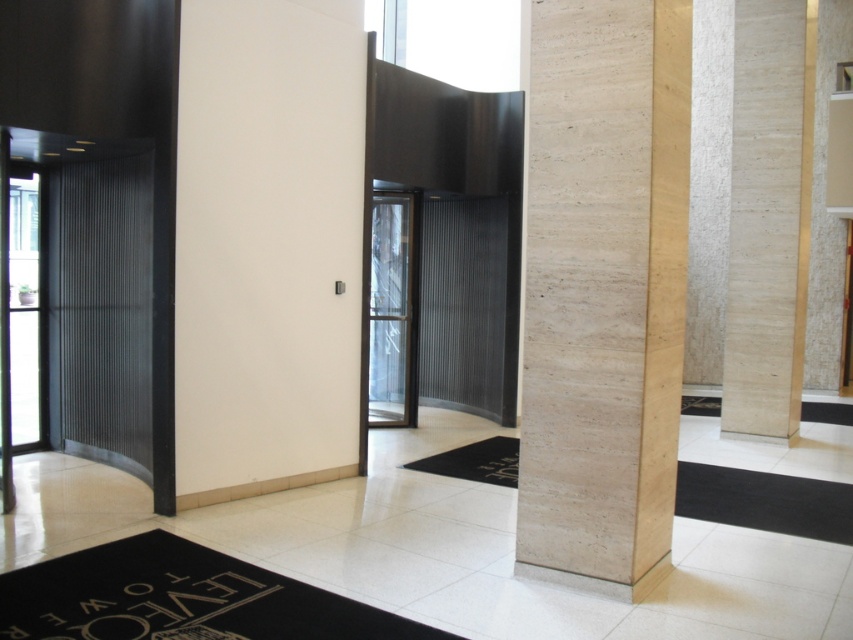
Question: Which of the following is the farthest from the observer?

Choices:
 (A) beige marble pillar at right
 (B) metallic ribbed elevator at left
 (C) transparent glass door at center

Answer: (C)

Question: Which of the following is the closest to the observer?

Choices:
 (A) metallic ribbed elevator at left
 (B) beige marble pillar at right

Answer: (B)

Question: Can you confirm if metallic ribbed elevator at left is positioned above transparent glass door at center?

Choices:
 (A) no
 (B) yes

Answer: (B)

Question: Does beige marble pillar at right appear under transparent glass door at center?

Choices:
 (A) yes
 (B) no

Answer: (B)

Question: Considering the relative positions of metallic ribbed elevator at left and transparent glass door at center in the image provided, where is metallic ribbed elevator at left located with respect to transparent glass door at center?

Choices:
 (A) left
 (B) right

Answer: (A)

Question: Which point is farther from the camera taking this photo?

Choices:
 (A) (396, 376)
 (B) (91, 368)

Answer: (A)